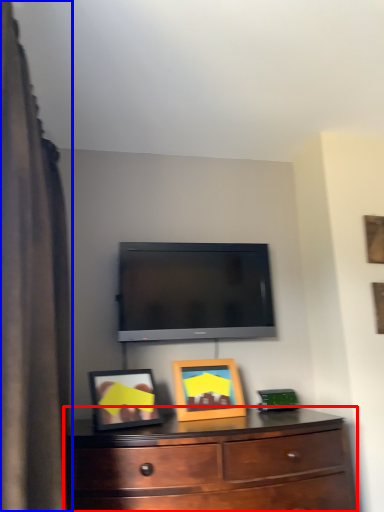
Question: Which object is closer to the camera taking this photo, chest of drawers (highlighted by a red box) or curtain (highlighted by a blue box)?

Choices:
 (A) chest of drawers
 (B) curtain

Answer: (B)